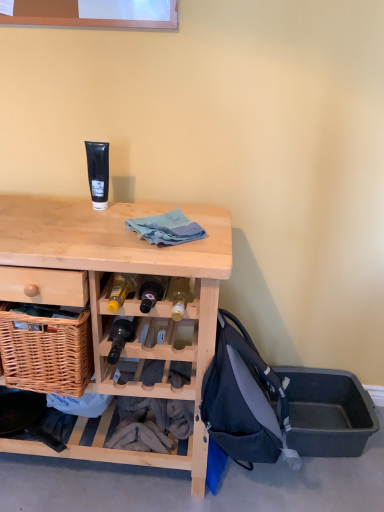
Locate an element on the screen. The width and height of the screenshot is (384, 512). free point in front of gray plastic storage box at lower right is located at coordinates (333, 486).